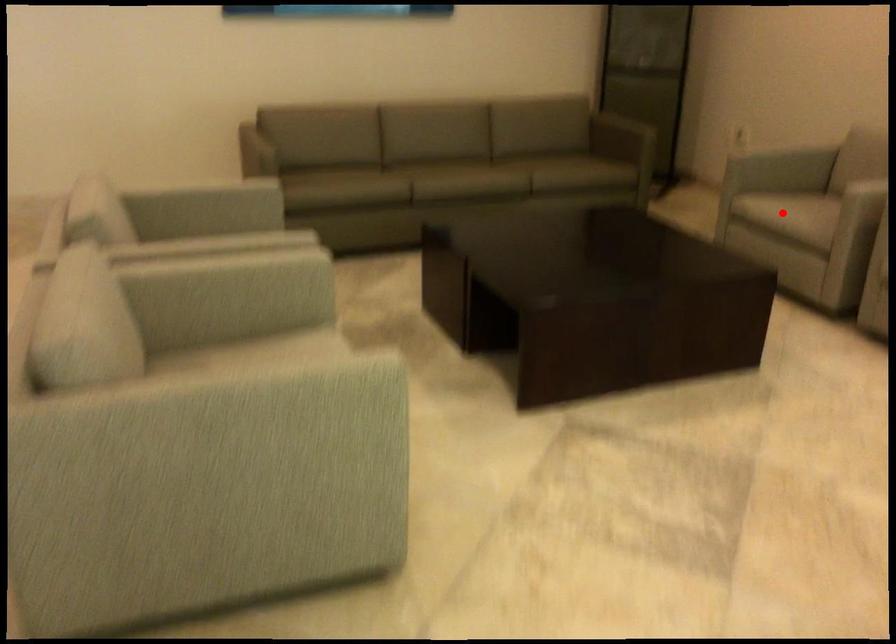
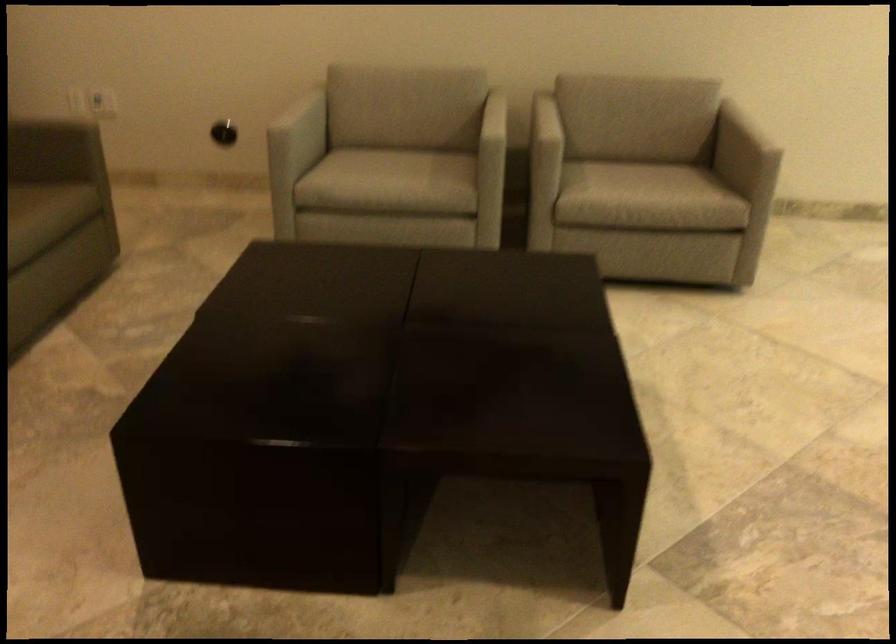
Find the pixel in the second image that matches the highlighted location in the first image.

(390, 176)